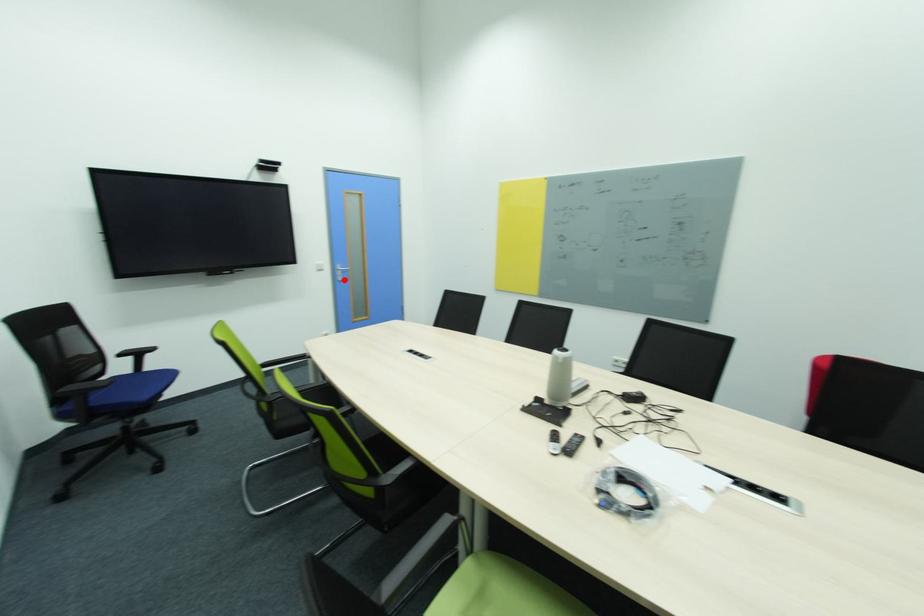
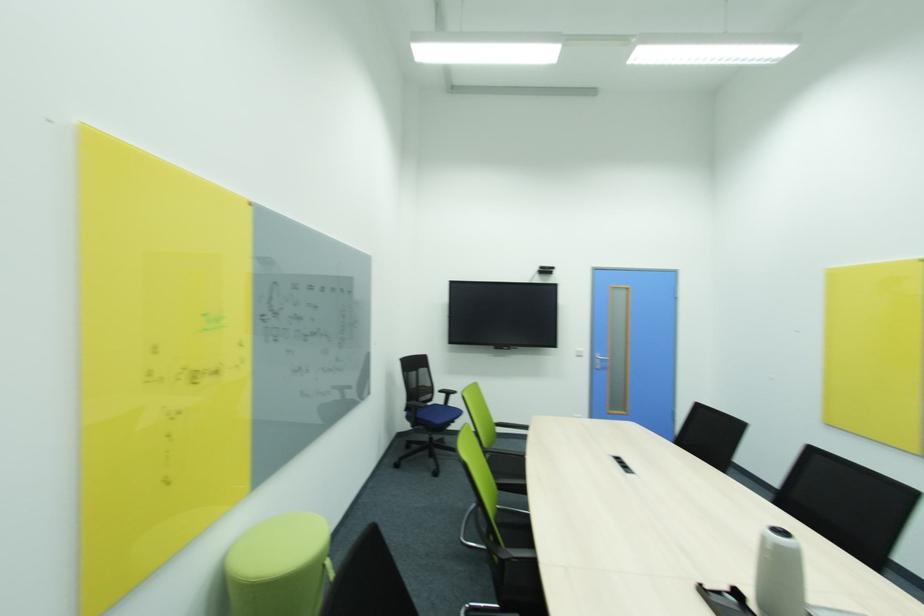
Question: I am providing you with two images of the same scene from different viewpoints. Image1 has a red point marked. In image2, the corresponding 3D location appears at what relative position? Reply with the corresponding letter.

Choices:
 (A) Closer
 (B) Farther

Answer: (B)